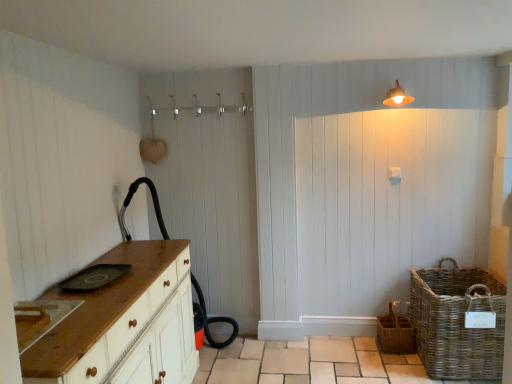
Where is `vacant area that is in front of woven wicker basket at lower right, acting as the 2th basket starting from the right`? This screenshot has width=512, height=384. vacant area that is in front of woven wicker basket at lower right, acting as the 2th basket starting from the right is located at coordinates (396, 363).